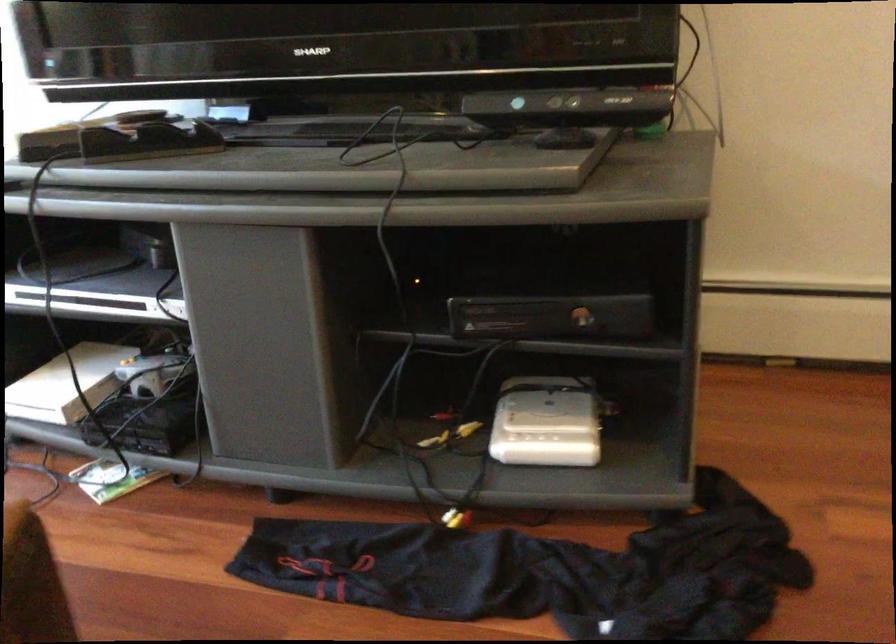
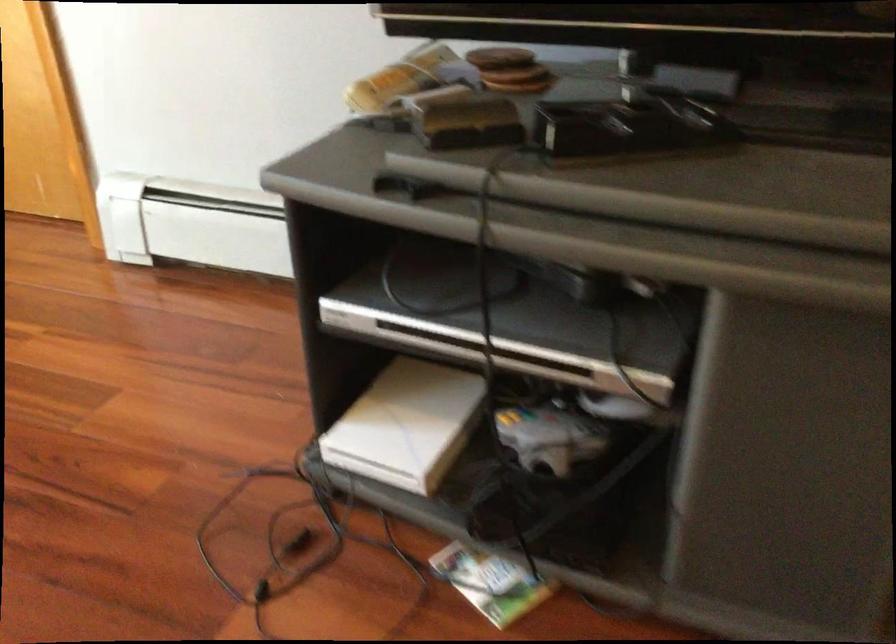
Locate, in the second image, the point that corresponds to pixel 133 117 in the first image.

(500, 58)